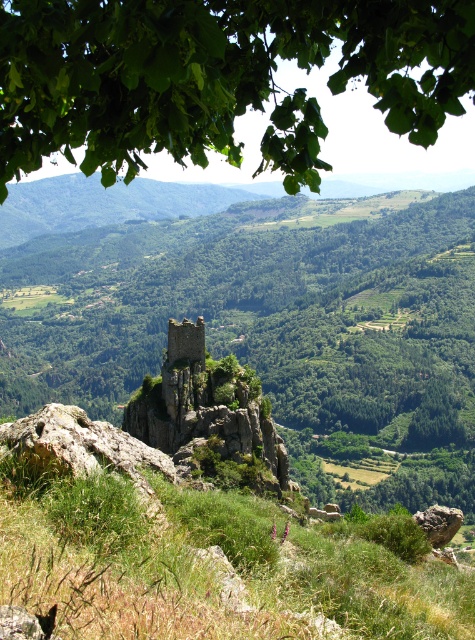
Is green leafy tree at center above rustic stone tower at center?

Indeed, green leafy tree at center is positioned over rustic stone tower at center.

Who is more forward, (198, 230) or (241, 458)?

Point (241, 458) is in front.

At what (x,y) coordinates should I click in order to perform the action: click on green leafy tree at center. Please return your answer as a coordinate pair (x, y). The width and height of the screenshot is (475, 640). Looking at the image, I should click on (272, 324).

Does green leafy tree at upper center appear over rustic stone tower at center?

Correct, green leafy tree at upper center is located above rustic stone tower at center.

Which is more to the right, green leafy tree at upper center or rustic stone tower at center?

green leafy tree at upper center

Describe the element at coordinates (216, 77) in the screenshot. I see `green leafy tree at upper center` at that location.

This screenshot has width=475, height=640. In order to click on green leafy tree at upper center in this screenshot , I will do `click(216, 77)`.

Is green grassy at center bigger than rustic stone tower at center?

Indeed, green grassy at center has a larger size compared to rustic stone tower at center.

I want to click on green grassy at center, so click(x=208, y=566).

Is point (235, 531) less distant than point (188, 454)?

That is True.

Identify the location of green grassy at center. (208, 566).